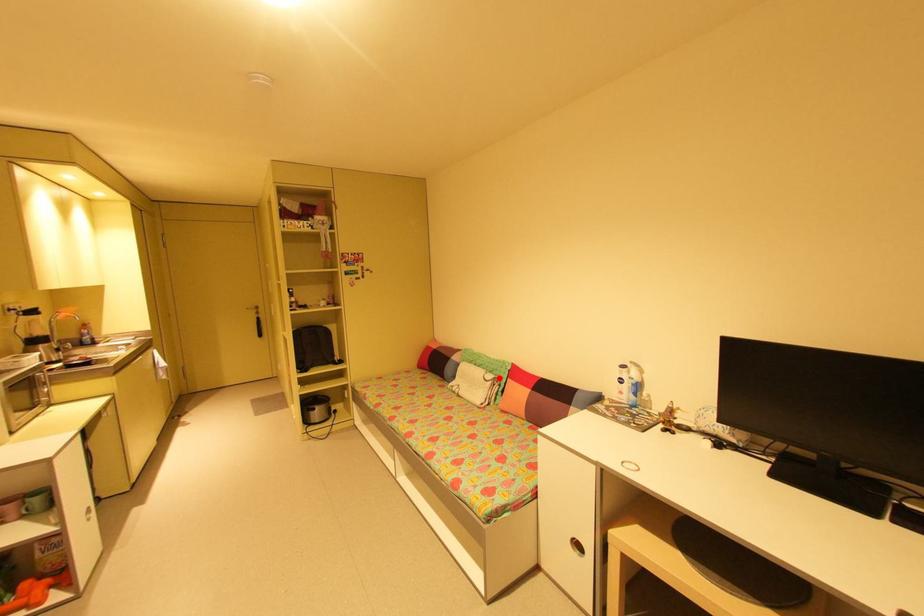
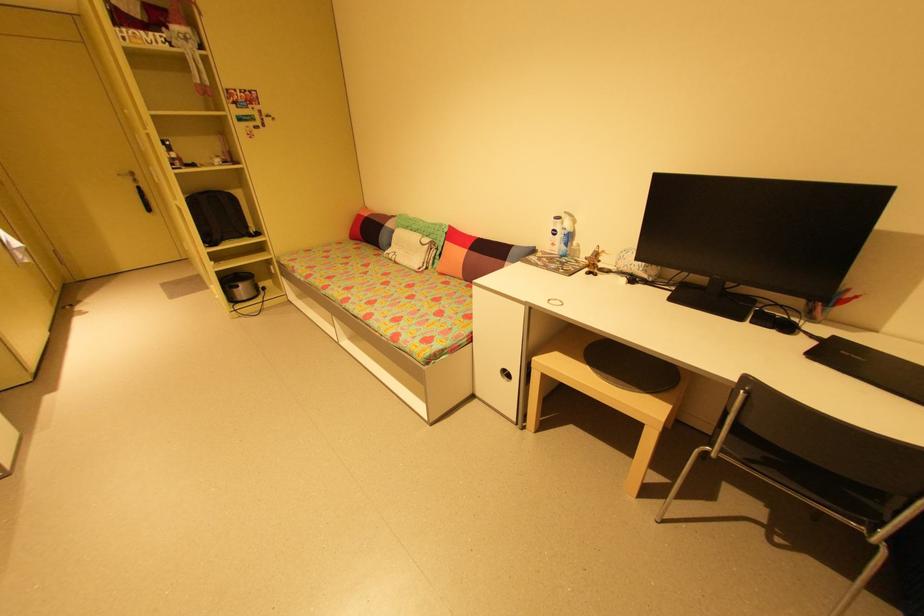
In the second image, find the point that corresponds to the highlighted location in the first image.

(435, 241)